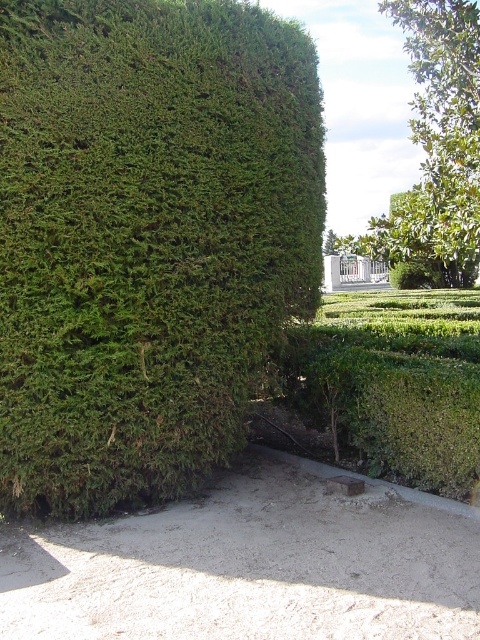
Is green leafy hedge at left above green leafy tree at upper right?

No.

Can you confirm if green leafy hedge at left is positioned to the right of green leafy tree at upper right?

Incorrect, green leafy hedge at left is not on the right side of green leafy tree at upper right.

Who is more distant from viewer, (x=264, y=340) or (x=468, y=136)?

Positioned behind is point (x=468, y=136).

Find the location of `green leafy hedge at left`. green leafy hedge at left is located at coordinates (145, 237).